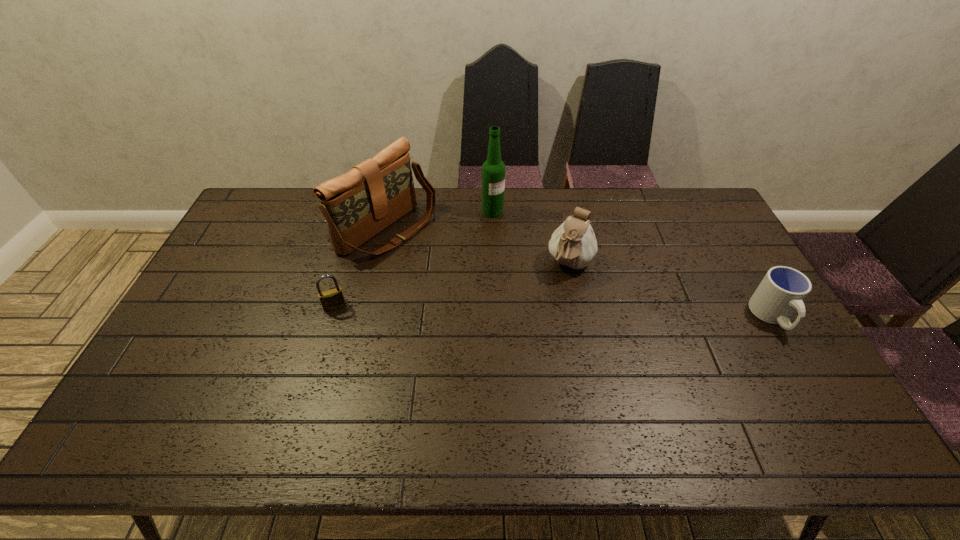
In order to click on free spot located 0.130m on the front-facing side of the fourth shortest object in this screenshot , I will do `click(452, 269)`.

Find the location of `free space located 0.230m on the front-facing side of the fourth shortest object`. free space located 0.230m on the front-facing side of the fourth shortest object is located at coordinates (476, 283).

This screenshot has height=540, width=960. Identify the location of free space located on the front-facing side of the second object from right to left. (533, 342).

Identify the location of vacant position located on the front-facing side of the second object from right to left. (549, 310).

Locate an element on the screen. vacant space situated 0.390m on the front-facing side of the second object from right to left is located at coordinates (515, 380).

Where is `free space located on the label of the beer bottle`? This screenshot has height=540, width=960. free space located on the label of the beer bottle is located at coordinates pyautogui.click(x=513, y=229).

Locate an element on the screen. This screenshot has width=960, height=540. free space located on the label of the beer bottle is located at coordinates (535, 247).

Locate an element on the screen. free space located 0.170m on the label of the beer bottle is located at coordinates (529, 242).

This screenshot has width=960, height=540. I want to click on shoulder bag that is at the far edge, so click(357, 205).

I want to click on beer bottle at the far edge, so click(493, 169).